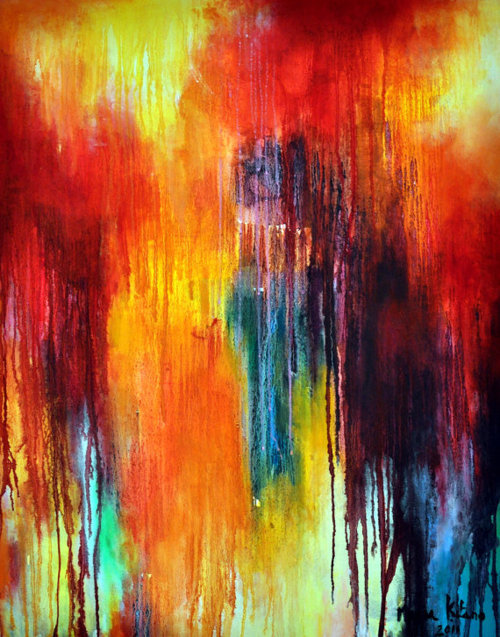
Locate an element on the screen. Image resolution: width=500 pixels, height=637 pixels. artwork is located at coordinates (247, 371).